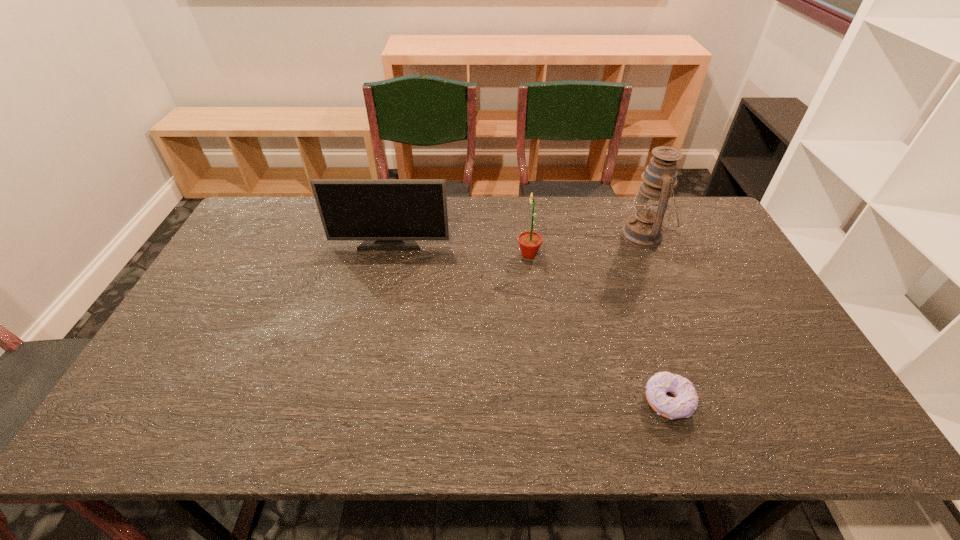
You are a GUI agent. You are given a task and a screenshot of the screen. Output one action in this format:
    pyautogui.click(x=<x>, y=<y>)
    Task: Click on the vacant area situated 0.260m on the left of the shortest object
    The height and width of the screenshot is (540, 960).
    Given the screenshot: What is the action you would take?
    pyautogui.click(x=531, y=401)

I want to click on oil lamp that is at the far edge, so click(x=644, y=229).

Where is `monitor situated at the far edge`? monitor situated at the far edge is located at coordinates (389, 214).

Locate an element on the screen. object that is at the near edge is located at coordinates point(683,405).

In order to click on blank space at the far edge in this screenshot , I will do `click(579, 215)`.

This screenshot has width=960, height=540. I want to click on free space at the near edge of the desktop, so click(287, 435).

The height and width of the screenshot is (540, 960). I want to click on vacant space at the left edge of the desktop, so click(x=211, y=303).

The image size is (960, 540). Find the location of `vacant region at the right edge of the desktop`. vacant region at the right edge of the desktop is located at coordinates (725, 335).

This screenshot has width=960, height=540. I want to click on vacant space at the far left corner of the desktop, so click(260, 205).

Locate an element on the screen. This screenshot has width=960, height=540. free location at the near left corner of the desktop is located at coordinates (186, 421).